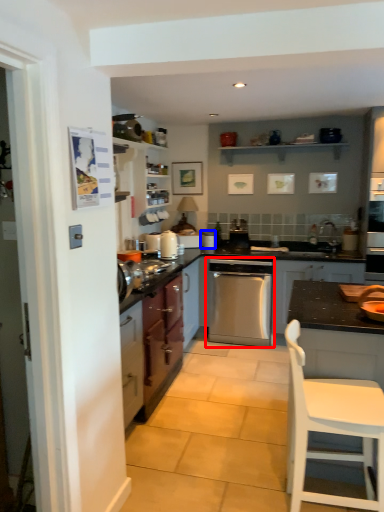
Question: Among these objects, which one is farthest to the camera, home appliance (highlighted by a red box) or appliance (highlighted by a blue box)?

Choices:
 (A) home appliance
 (B) appliance

Answer: (B)